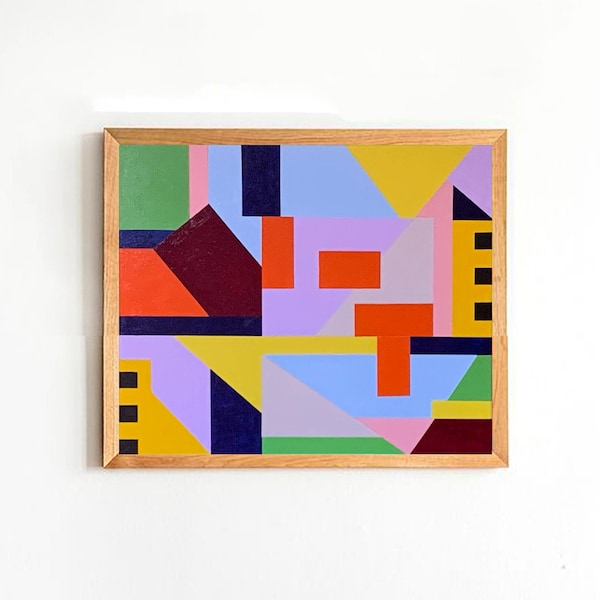
Locate an element on the screen. the top leftmost corner of wooden frame is located at coordinates (105, 128).